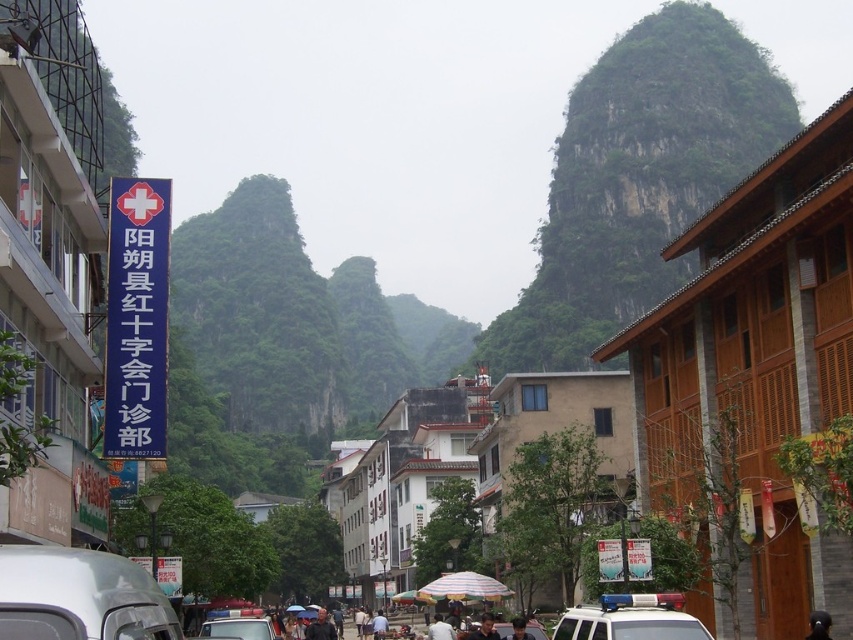
Question: Which is farther from the white fabric umbrella at center?

Choices:
 (A) white matte car at center
 (B) white matte car at lower left

Answer: (B)

Question: Observing the image, what is the correct spatial positioning of green rocky mountain at center in reference to dark brown hair at center?

Choices:
 (A) above
 (B) below

Answer: (A)

Question: Which point appears farthest from the camera in this image?

Choices:
 (A) (221, 628)
 (B) (489, 625)
 (C) (431, 632)

Answer: (C)

Question: Is white matte car at center to the left of white fabric umbrella at center from the viewer's perspective?

Choices:
 (A) yes
 (B) no

Answer: (A)

Question: From the image, what is the correct spatial relationship of dark gray shirt at center in relation to dark brown hair at center?

Choices:
 (A) right
 (B) left

Answer: (B)

Question: Which object is positioned closest to the dark brown leather jacket at center?

Choices:
 (A) dark gray shirt at center
 (B) dark brown hair at center
 (C) white fabric umbrella at center
 (D) white matte car at lower left

Answer: (B)